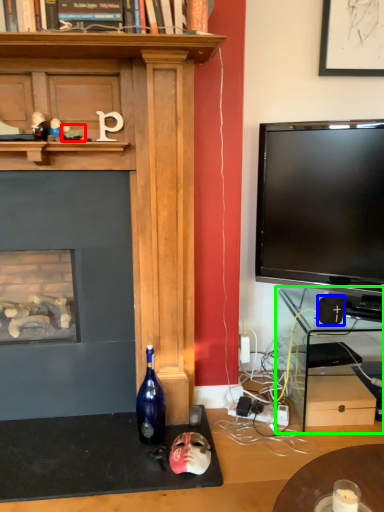
Question: Which object is the closest to the toy (highlighted by a red box)? Choose among these: speaker (highlighted by a blue box) or computer desk (highlighted by a green box).

Choices:
 (A) speaker
 (B) computer desk

Answer: (A)